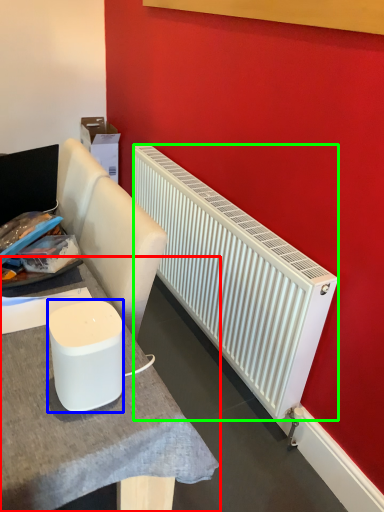
Question: Based on their relative distances, which object is nearer to table (highlighted by a red box)? Choose from appliance (highlighted by a blue box) and radiator (highlighted by a green box).

Choices:
 (A) appliance
 (B) radiator

Answer: (A)